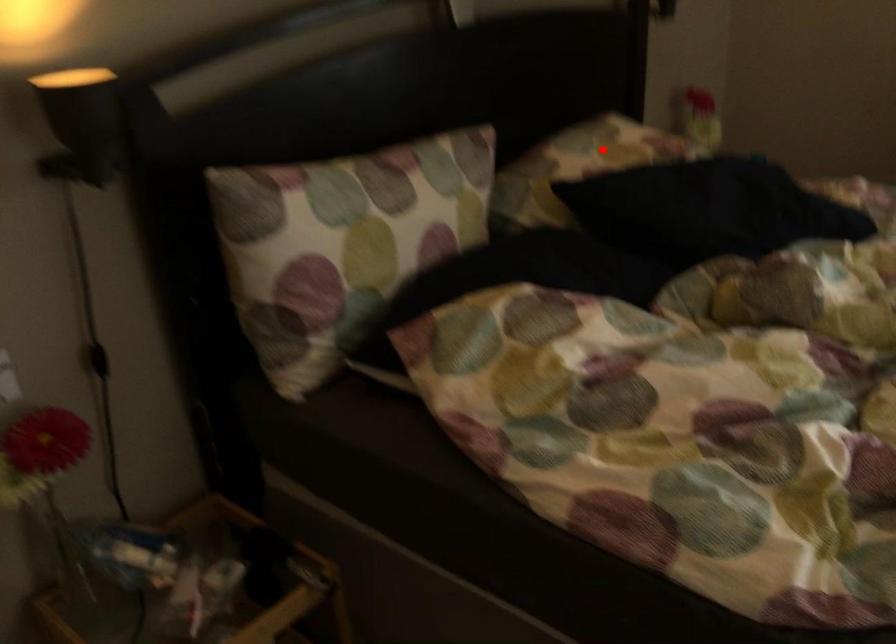
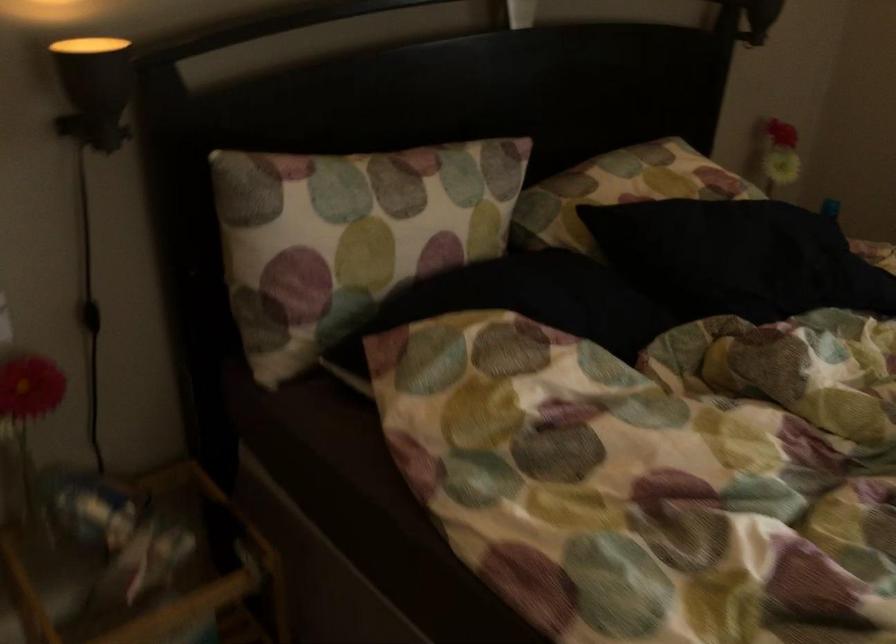
Where in the second image is the point corresponding to the highlighted location from the first image?

(649, 176)